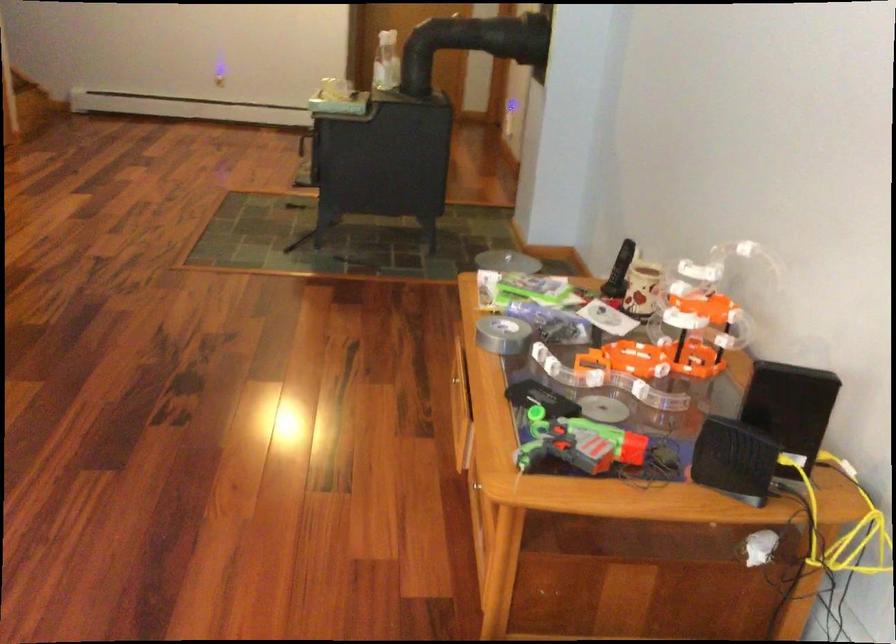
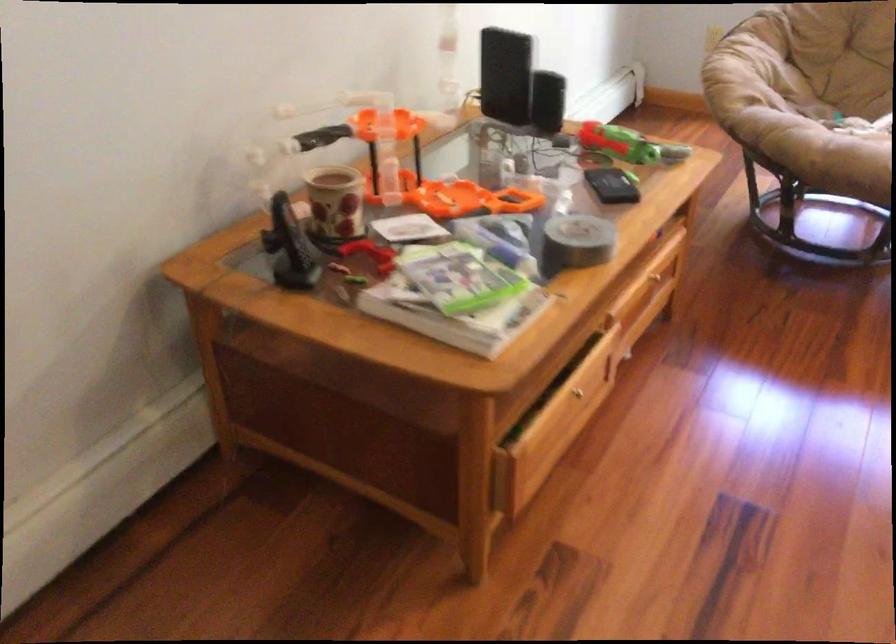
The point at (498, 319) is marked in the first image. Where is the corresponding point in the second image?

(576, 242)